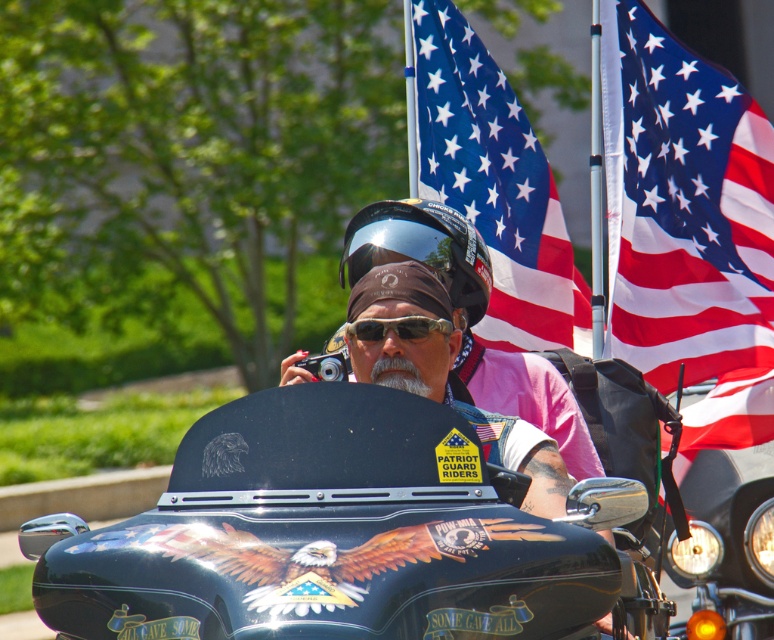
Is glossy black motorcycle at center closer to the viewer compared to red-white-blue fabric flag at upper right?

Yes, glossy black motorcycle at center is closer to the viewer.

Between glossy black motorcycle at center and red-white-blue fabric flag at upper right, which one is positioned higher?

red-white-blue fabric flag at upper right

Image resolution: width=774 pixels, height=640 pixels. In order to click on glossy black motorcycle at center in this screenshot , I will do `click(341, 534)`.

Find the location of a particular element. glossy black motorcycle at center is located at coordinates (341, 534).

Is glossy black motorcycle at center thinner than glossy black helmet at center?

In fact, glossy black motorcycle at center might be wider than glossy black helmet at center.

Is point (302, 417) in front of point (437, 257)?

That is True.

Locate an element on the screen. This screenshot has width=774, height=640. glossy black motorcycle at center is located at coordinates (341, 534).

Find the location of `blue fabric flag at upper center`. blue fabric flag at upper center is located at coordinates (491, 180).

Can you confirm if blue fabric flag at upper center is smaller than matte black goggles at center?

Indeed, blue fabric flag at upper center has a smaller size compared to matte black goggles at center.

Describe the element at coordinates (491, 180) in the screenshot. I see `blue fabric flag at upper center` at that location.

Where is `blue fabric flag at upper center`? The height and width of the screenshot is (640, 774). blue fabric flag at upper center is located at coordinates (491, 180).